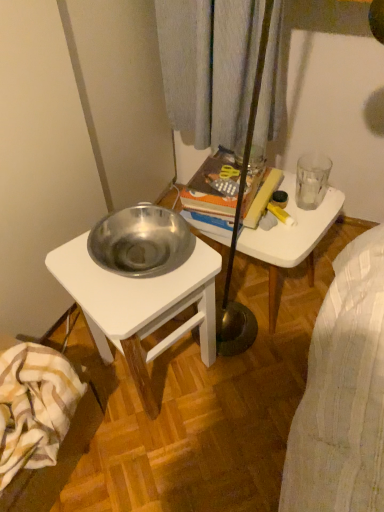
What are the coordinates of `free space above polished silver bowl at left (from a real-world perspective)` in the screenshot? It's located at (134, 263).